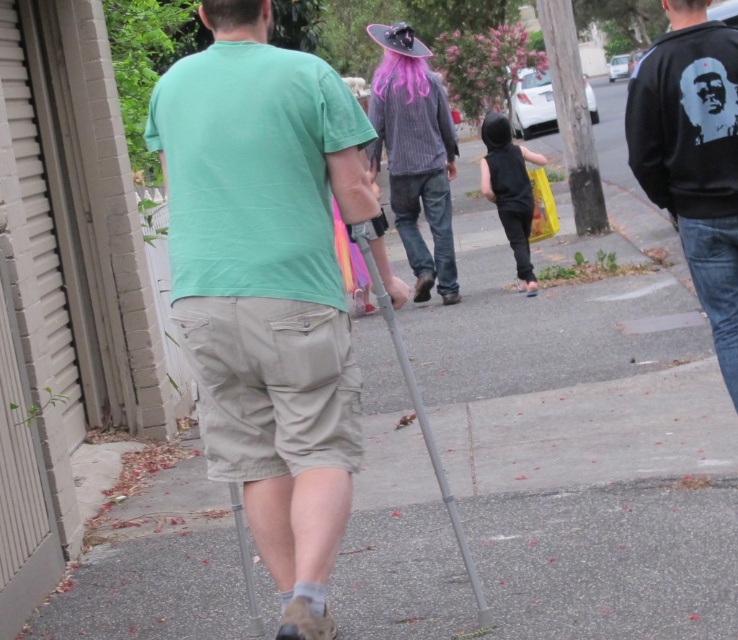
Is pink silky hair at upper center shorter than metallic gray crutch at lower center?

Yes, pink silky hair at upper center is shorter than metallic gray crutch at lower center.

The width and height of the screenshot is (738, 640). Find the location of `pink silky hair at upper center`. pink silky hair at upper center is located at coordinates (234, 13).

Is striped fabric shirt at center further to the viewer compared to pink silky hair at upper center?

Yes, striped fabric shirt at center is further from the viewer.

Who is lower down, striped fabric shirt at center or pink silky hair at upper center?

pink silky hair at upper center

Where is `striped fabric shirt at center`? This screenshot has width=738, height=640. striped fabric shirt at center is located at coordinates (415, 154).

Identify the location of green matte t-shirt at center. (266, 291).

Can you confirm if green matte t-shirt at center is positioned to the left of striped fabric shirt at center?

Indeed, green matte t-shirt at center is positioned on the left side of striped fabric shirt at center.

This screenshot has height=640, width=738. What do you see at coordinates (266, 291) in the screenshot? I see `green matte t-shirt at center` at bounding box center [266, 291].

Find the location of a particular element. This screenshot has height=640, width=738. green matte t-shirt at center is located at coordinates (266, 291).